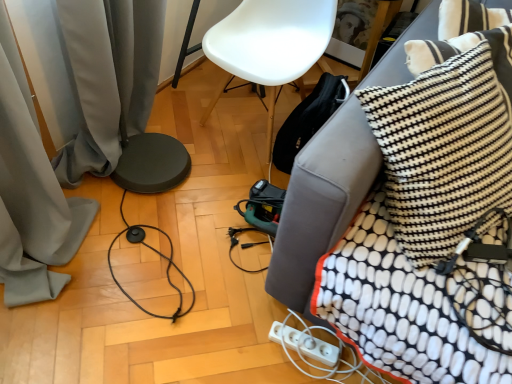
Measure the distance between point (x=357, y=297) and camera.

A distance of 3.48 feet exists between point (x=357, y=297) and camera.

The width and height of the screenshot is (512, 384). I want to click on black fabric couch at lower right, so click(365, 264).

What is the approximate height of white plastic power strip at lower right?

4.49 centimeters.

What do you see at coordinates (304, 344) in the screenshot?
I see `white plastic power strip at lower right` at bounding box center [304, 344].

Find the location of a particular element. The height and width of the screenshot is (384, 512). white plastic extension cord at lower right is located at coordinates (319, 351).

Are white textured blanket at right and gray fabric curtain at lower left located far from each other?

Yes, white textured blanket at right and gray fabric curtain at lower left are quite far apart.

Is point (401, 284) behind point (109, 147)?

No.

Is gray fabric curtain at lower left a part of white textured blanket at right?

No, white textured blanket at right does not contain gray fabric curtain at lower left.

Is white textured blanket at right looking in the opposite direction of gray fabric curtain at lower left?

That's right, white textured blanket at right is facing away from gray fabric curtain at lower left.

Considering the positions of point (490, 111) and point (304, 352), is point (490, 111) closer or farther from the camera than point (304, 352)?

Point (490, 111) appears to be closer to the viewer than point (304, 352).

Does black and white woven pillow at upper right lie behind white plastic extension cord at lower right?

No, it is in front of white plastic extension cord at lower right.

Who is taller, black and white woven pillow at upper right or white plastic extension cord at lower right?

black and white woven pillow at upper right is taller.

Is black and white woven pillow at upper right looking in the opposite direction of white plastic extension cord at lower right?

No, black and white woven pillow at upper right is not facing the opposite direction of white plastic extension cord at lower right.

Is black and white woven pillow at upper right facing away from white plastic power strip at lower right?

No, black and white woven pillow at upper right is not facing away from white plastic power strip at lower right.

From the picture: Would you say black and white woven pillow at upper right is outside white plastic power strip at lower right?

That's correct, black and white woven pillow at upper right is outside of white plastic power strip at lower right.

Which point is more distant from viewer, (x=468, y=148) or (x=310, y=340)?

Positioned behind is point (x=310, y=340).

Is black and white woven pillow at upper right further to camera compared to white plastic power strip at lower right?

No, it is in front of white plastic power strip at lower right.

From a real-world perspective, is black fabric couch at lower right physically located above or below white plastic extension cord at lower right?

From a real-world perspective, black fabric couch at lower right is physically above white plastic extension cord at lower right.

Which is in front, point (377, 326) or point (317, 375)?

Point (377, 326)

Considering the sizes of objects black fabric couch at lower right and white plastic extension cord at lower right in the image provided, who is bigger, black fabric couch at lower right or white plastic extension cord at lower right?

With larger size is black fabric couch at lower right.

In the scene shown: Considering the relative positions of black fabric couch at lower right and white plastic extension cord at lower right in the image provided, is black fabric couch at lower right to the right of white plastic extension cord at lower right from the viewer's perspective?

Yes.

Could you tell me if white plastic chair at center is facing gray fabric curtain at lower left?

Yes, white plastic chair at center is facing gray fabric curtain at lower left.

Considering the positions of objects white plastic chair at center and gray fabric curtain at lower left in the image provided, who is more to the right, white plastic chair at center or gray fabric curtain at lower left?

Positioned to the right is white plastic chair at center.

From the image's perspective, is white plastic chair at center positioned above or below gray fabric curtain at lower left?

Clearly, from the image's perspective, white plastic chair at center is above gray fabric curtain at lower left.

Is white plastic chair at center spatially inside gray fabric curtain at lower left, or outside of it?

white plastic chair at center cannot be found inside gray fabric curtain at lower left.

From a real-world perspective, which is physically above, gray fabric curtain at lower left or black fabric couch at lower right?

gray fabric curtain at lower left is physically above.

Is point (83, 58) farther from camera compared to point (407, 269)?

Yes, point (83, 58) is farther from viewer.

Does gray fabric curtain at lower left have a greater width compared to black fabric couch at lower right?

Incorrect, the width of gray fabric curtain at lower left does not surpass that of black fabric couch at lower right.

Could you tell me if gray fabric curtain at lower left is facing white plastic chair at center?

No, gray fabric curtain at lower left is not oriented towards white plastic chair at center.

Is gray fabric curtain at lower left positioned in front of white plastic chair at center?

Yes, gray fabric curtain at lower left is closer to the viewer.

Considering the positions of objects gray fabric curtain at lower left and white plastic chair at center in the image provided, who is more to the left, gray fabric curtain at lower left or white plastic chair at center?

gray fabric curtain at lower left is more to the left.

The width and height of the screenshot is (512, 384). What are the coordinates of `blanket on the right of gray fabric curtain at lower left` in the screenshot? It's located at 414,307.

This screenshot has height=384, width=512. What are the coordinates of `extension cord on the left of black and white woven pillow at upper right` in the screenshot? It's located at (319, 351).

Which object lies further to the anchor point black fabric couch at lower right, white plastic power strip at lower right or white plastic chair at center?

white plastic chair at center.

Which object lies nearer to the anchor point white plastic power strip at lower right, white plastic chair at center or black and white woven pillow at upper right?

black and white woven pillow at upper right lies closer to white plastic power strip at lower right than the other object.

Which object lies further to the anchor point white plastic power strip at lower right, white textured blanket at right or black fabric couch at lower right?

black fabric couch at lower right lies further to white plastic power strip at lower right than the other object.

Considering their positions, is black and white woven pillow at upper right positioned closer to white plastic power strip at lower right than black fabric couch at lower right?

black fabric couch at lower right.

Estimate the real-world distances between objects in this image. Which object is further from white textured blanket at right, gray fabric curtain at lower left or black and white woven pillow at upper right?

Among the two, gray fabric curtain at lower left is located further to white textured blanket at right.

From the image, which object appears to be nearer to black fabric couch at lower right, white plastic extension cord at lower right or white textured blanket at right?

Among the two, white textured blanket at right is located nearer to black fabric couch at lower right.

Based on their spatial positions, is gray fabric curtain at lower left or white textured blanket at right closer to white plastic chair at center?

The object closer to white plastic chair at center is gray fabric curtain at lower left.

Looking at the image, which one is located further to gray fabric curtain at lower left, black fabric couch at lower right or white textured blanket at right?

white textured blanket at right is positioned further to the anchor gray fabric curtain at lower left.

The height and width of the screenshot is (384, 512). I want to click on blanket between white plastic chair at center and white plastic power strip at lower right from top to bottom, so click(x=414, y=307).

Locate an element on the screen. pillow that lies between white plastic chair at center and white plastic extension cord at lower right from top to bottom is located at coordinates (446, 149).

I want to click on electric outlet between white plastic chair at center and white plastic extension cord at lower right in the vertical direction, so click(304, 344).

Identify the location of curtain between white plastic chair at center and white plastic extension cord at lower right from top to bottom. This screenshot has width=512, height=384. (117, 96).